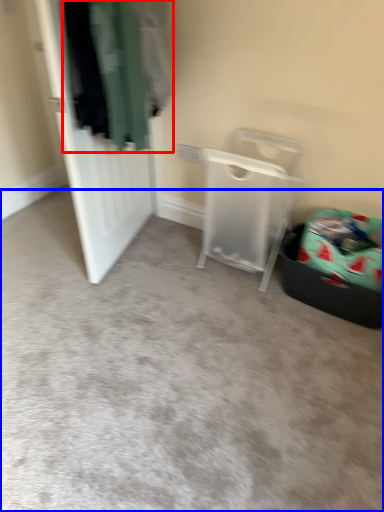
Question: Which object is further to the camera taking this photo, clothing (highlighted by a red box) or plain (highlighted by a blue box)?

Choices:
 (A) clothing
 (B) plain

Answer: (A)